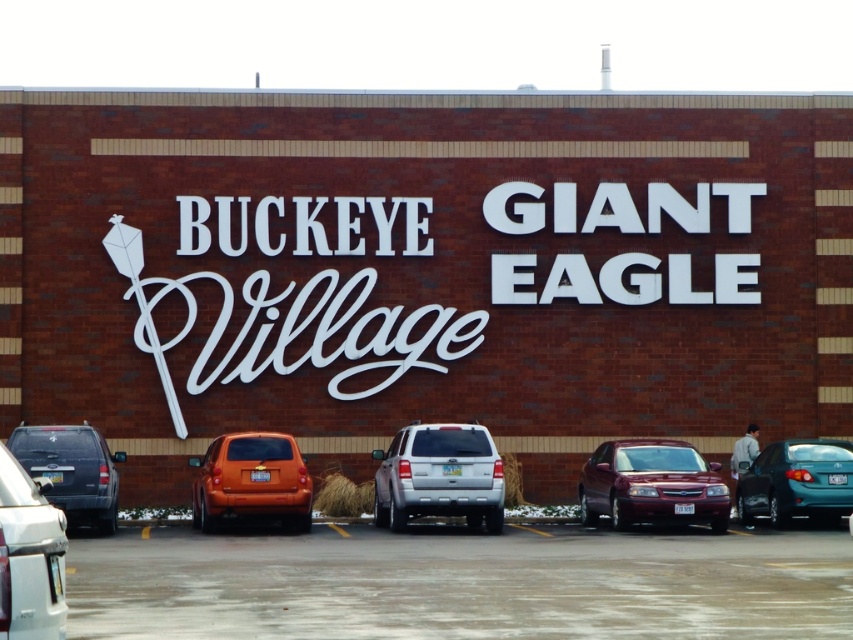
Question: Based on their relative distances, which object is farther from the shiny maroon sedan at center?

Choices:
 (A) matte black suv at left
 (B) silver metallic suv at center

Answer: (A)

Question: Which object is farther from the camera taking this photo?

Choices:
 (A) matte black suv at left
 (B) silver metallic suv at lower left
 (C) silver metallic suv at center

Answer: (C)

Question: Does gray asphalt parking lot at lower center appear over shiny maroon sedan at center?

Choices:
 (A) yes
 (B) no

Answer: (B)

Question: Is orange matte suv at lower left to the left of matte black suv at left from the viewer's perspective?

Choices:
 (A) yes
 (B) no

Answer: (B)

Question: Can you confirm if silver metallic suv at lower left is positioned above teal glossy sedan at lower right?

Choices:
 (A) no
 (B) yes

Answer: (B)

Question: Which of the following is the closest to the observer?

Choices:
 (A) (256, 460)
 (B) (419, 476)
 (C) (752, 490)

Answer: (B)